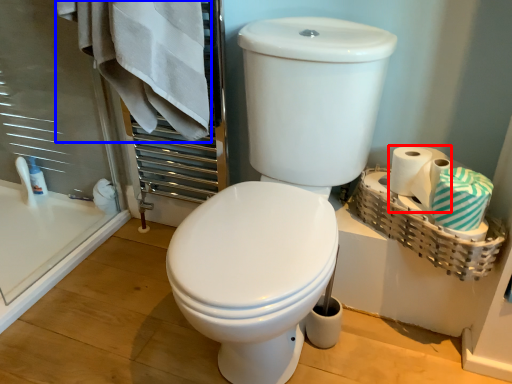
Question: Among these objects, which one is nearest to the camera, toilet paper (highlighted by a red box) or bath towel (highlighted by a blue box)?

Choices:
 (A) toilet paper
 (B) bath towel

Answer: (B)